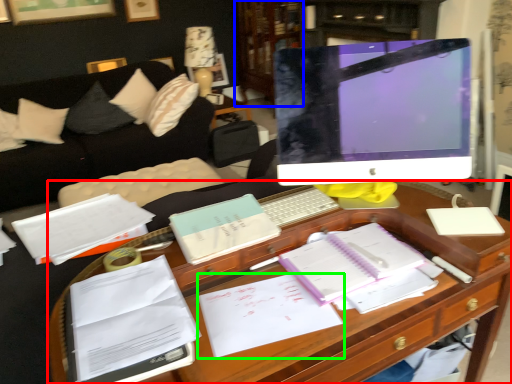
Question: Based on their relative distances, which object is nearer to desk (highlighted by a red box)? Choose from bookshelf (highlighted by a blue box) and document (highlighted by a green box).

Choices:
 (A) bookshelf
 (B) document

Answer: (B)